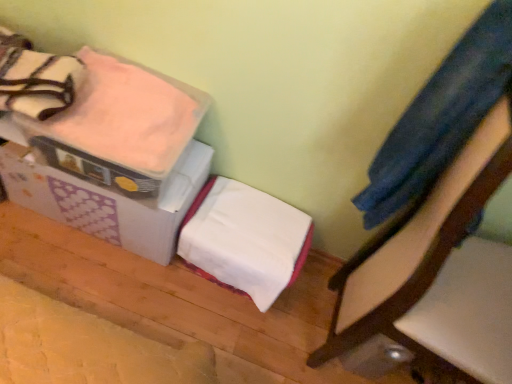
Question: Can you confirm if white cardboard box at upper left is smaller than wooden chair at right?

Choices:
 (A) yes
 (B) no

Answer: (A)

Question: Is white cardboard box at upper left positioned far away from wooden chair at right?

Choices:
 (A) no
 (B) yes

Answer: (A)

Question: Does white cardboard box at upper left have a greater width compared to wooden chair at right?

Choices:
 (A) yes
 (B) no

Answer: (B)

Question: From a real-world perspective, is white cardboard box at upper left beneath wooden chair at right?

Choices:
 (A) no
 (B) yes

Answer: (B)

Question: Is white cardboard box at upper left aimed at wooden chair at right?

Choices:
 (A) yes
 (B) no

Answer: (B)

Question: Is white cardboard box at upper left touching wooden chair at right?

Choices:
 (A) no
 (B) yes

Answer: (A)

Question: Considering the relative sizes of white soft blanket at center, the 2th blanket viewed from the top, and pink soft fabric blanket at upper left, the second blanket when ordered from bottom to top, in the image provided, is white soft blanket at center, the 2th blanket viewed from the top, shorter than pink soft fabric blanket at upper left, the second blanket when ordered from bottom to top,?

Choices:
 (A) yes
 (B) no

Answer: (B)

Question: Is the position of white soft blanket at center, marked as the first blanket in a bottom-to-top arrangement, less distant than that of pink soft fabric blanket at upper left, the 1th blanket in the top-to-bottom sequence?

Choices:
 (A) yes
 (B) no

Answer: (B)

Question: Is white soft blanket at center, the 2th blanket viewed from the top, to the left of pink soft fabric blanket at upper left, the second blanket when ordered from bottom to top, from the viewer's perspective?

Choices:
 (A) yes
 (B) no

Answer: (B)

Question: Are white soft blanket at center, marked as the first blanket in a bottom-to-top arrangement, and pink soft fabric blanket at upper left, the 1th blanket in the top-to-bottom sequence, far apart?

Choices:
 (A) yes
 (B) no

Answer: (B)

Question: Can you confirm if white soft blanket at center, marked as the first blanket in a bottom-to-top arrangement, is taller than pink soft fabric blanket at upper left, the 1th blanket in the top-to-bottom sequence?

Choices:
 (A) no
 (B) yes

Answer: (B)

Question: From the image's perspective, is white soft blanket at center, the 2th blanket viewed from the top, below pink soft fabric blanket at upper left, the second blanket when ordered from bottom to top?

Choices:
 (A) no
 (B) yes

Answer: (B)

Question: Is pink soft fabric blanket at upper left, the 1th blanket in the top-to-bottom sequence, looking in the opposite direction of wooden chair at right?

Choices:
 (A) no
 (B) yes

Answer: (A)